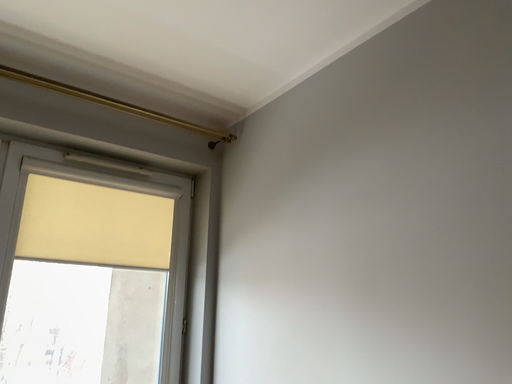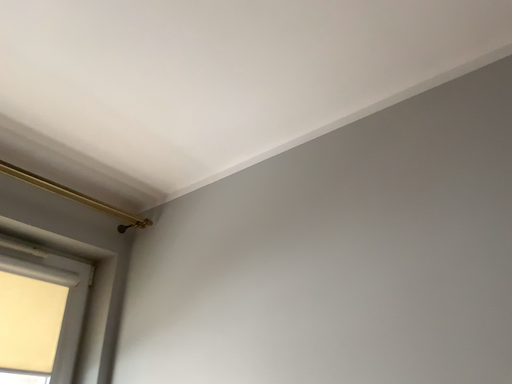
Question: How did the camera likely rotate when shooting the video?

Choices:
 (A) rotated left
 (B) rotated right

Answer: (B)